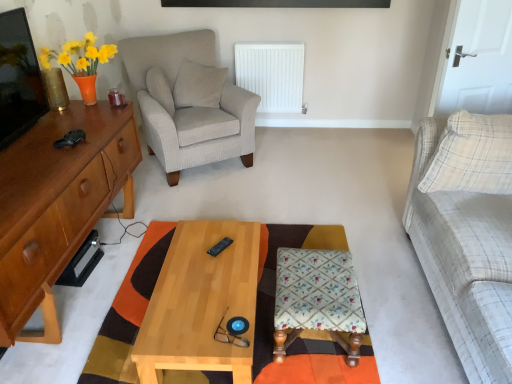
This screenshot has height=384, width=512. I want to click on free location in front of light gray textured armchair at center, so click(212, 195).